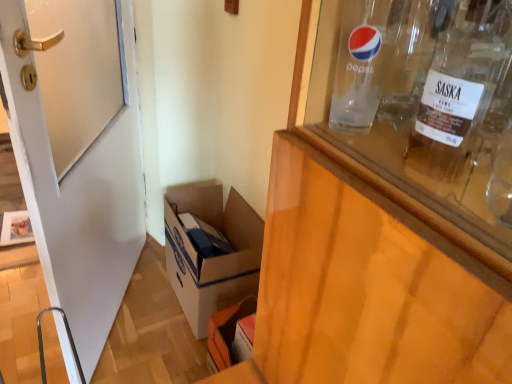
Question: Considering the relative positions of clear glass bottle at upper right and white glossy door at left in the image provided, is clear glass bottle at upper right to the left or to the right of white glossy door at left?

Choices:
 (A) right
 (B) left

Answer: (A)

Question: In the image, is clear glass bottle at upper right positioned in front of or behind white glossy door at left?

Choices:
 (A) behind
 (B) front

Answer: (B)

Question: Estimate the real-world distances between objects in this image. Which object is farther from the white glossy door at left?

Choices:
 (A) transparent glass bottle at upper right
 (B) clear glass bottle at upper right
 (C) white cardboard box at lower left

Answer: (A)

Question: Which object is positioned farthest from the white cardboard box at lower left?

Choices:
 (A) clear glass bottle at upper right
 (B) white glossy door at left
 (C) transparent glass bottle at upper right

Answer: (C)